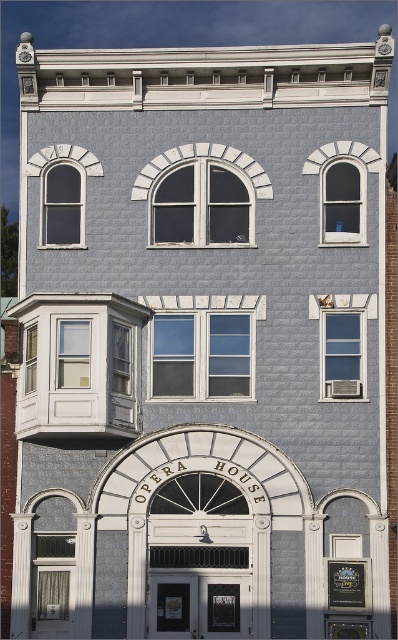
Question: Which point appears farthest from the camera in this image?

Choices:
 (A) (74, 346)
 (B) (306, 164)
 (C) (27, 358)

Answer: (B)

Question: Does clear glass window at center have a greater width compared to wooden frame window at center?

Choices:
 (A) yes
 (B) no

Answer: (A)

Question: Which point appears farthest from the camera in this image?

Choices:
 (A) (31, 355)
 (B) (339, 344)
 (C) (179, 189)

Answer: (C)

Question: Which point is farther to the camera?

Choices:
 (A) (62, 385)
 (B) (76, 204)
 (C) (345, 376)
 (D) (214, 340)

Answer: (B)

Question: Can you confirm if wooden frame window at center is positioned to the right of clear glass window at left?

Choices:
 (A) yes
 (B) no

Answer: (A)

Question: Can you confirm if clear glass window at upper right is positioned above wooden frame window at center?

Choices:
 (A) no
 (B) yes

Answer: (B)